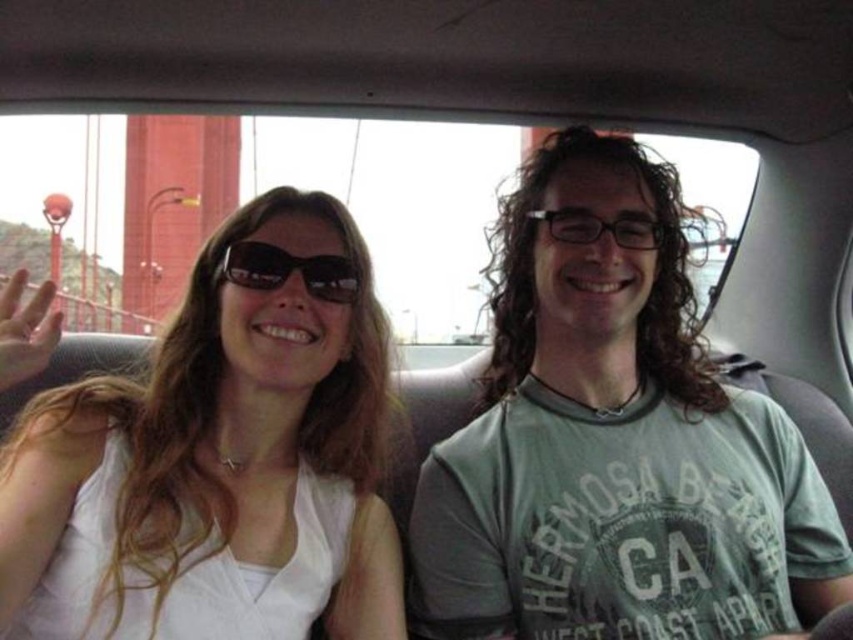
Find the location of a particular element. green cotton t-shirt at center is located at coordinates (614, 445).

This screenshot has height=640, width=853. What are the coordinates of `green cotton t-shirt at center` in the screenshot? It's located at (614, 445).

Is white fabric shirt at left closer to camera compared to transparent plastic glasses at center?

Yes, it is in front of transparent plastic glasses at center.

Does point (344, 568) come in front of point (544, 220)?

Yes, point (344, 568) is in front of point (544, 220).

Find the location of a particular element. white fabric shirt at left is located at coordinates (218, 458).

Is black plastic sunglasses at upper center taller than transparent plastic glasses at center?

Yes, black plastic sunglasses at upper center is taller than transparent plastic glasses at center.

Is the position of black plastic sunglasses at upper center more distant than that of transparent plastic glasses at center?

No, black plastic sunglasses at upper center is in front of transparent plastic glasses at center.

Measure the distance between black plastic sunglasses at upper center and camera.

3.87 feet

The height and width of the screenshot is (640, 853). Find the location of `black plastic sunglasses at upper center`. black plastic sunglasses at upper center is located at coordinates (289, 269).